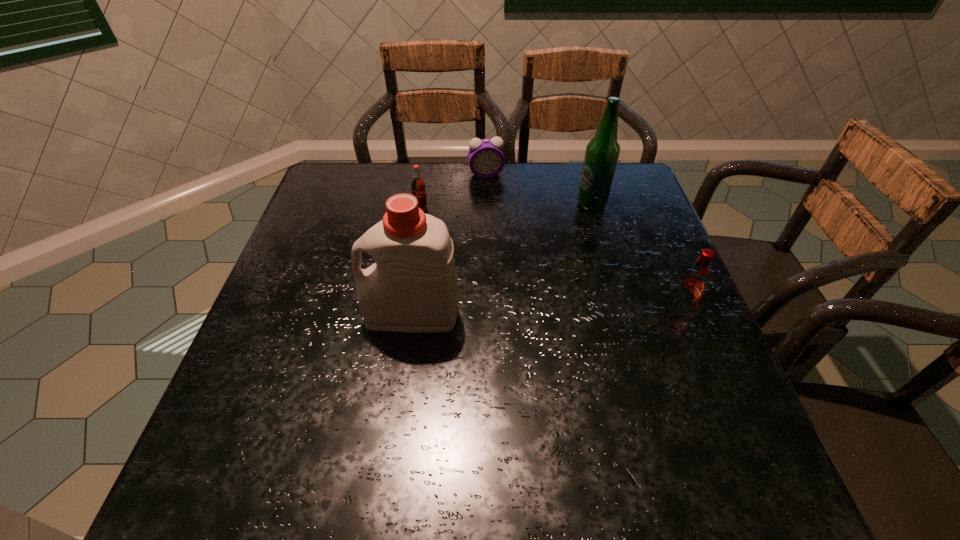
Where is `vacant space on the desktop that is between the detergent and the rightmost object and is positioned on the label of the fourth object from left to right`? The height and width of the screenshot is (540, 960). vacant space on the desktop that is between the detergent and the rightmost object and is positioned on the label of the fourth object from left to right is located at coordinates tap(521, 314).

The width and height of the screenshot is (960, 540). I want to click on vacant spot on the desktop that is between the detergent and the root beer and is positioned on the label of the soda bottle, so click(x=582, y=314).

Image resolution: width=960 pixels, height=540 pixels. In order to click on free spot on the desktop that is between the detergent and the rightmost object and is positioned on the face of the alarm clock in this screenshot , I will do `click(520, 314)`.